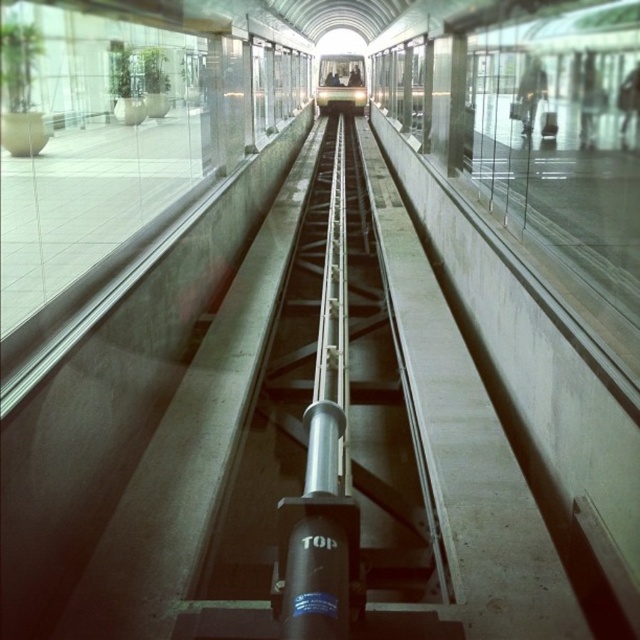
Can you confirm if silver metallic rail at center is wider than metallic silver train at center?

Incorrect, silver metallic rail at center's width does not surpass metallic silver train at center's.

Does silver metallic rail at center have a lesser width compared to metallic silver train at center?

Yes.

Describe the element at coordinates (323, 467) in the screenshot. The image size is (640, 640). I see `silver metallic rail at center` at that location.

Locate an element on the screen. This screenshot has width=640, height=640. silver metallic rail at center is located at coordinates (323, 467).